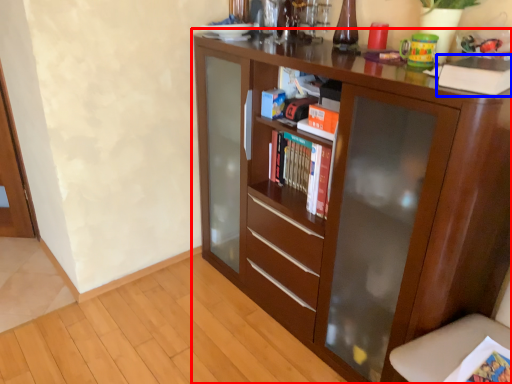
Question: Among these objects, which one is farthest to the camera, cupboard (highlighted by a red box) or paperback book (highlighted by a blue box)?

Choices:
 (A) cupboard
 (B) paperback book

Answer: (B)